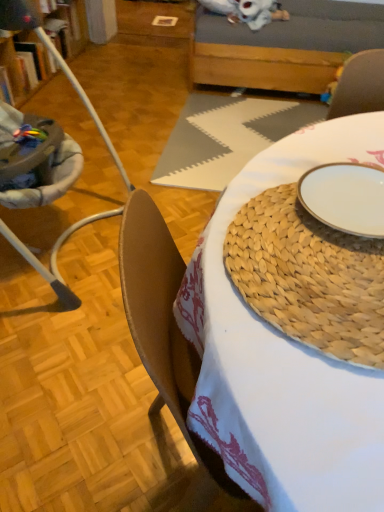
The height and width of the screenshot is (512, 384). I want to click on blank space above natural woven placemat at center (from a real-world perspective), so click(x=330, y=244).